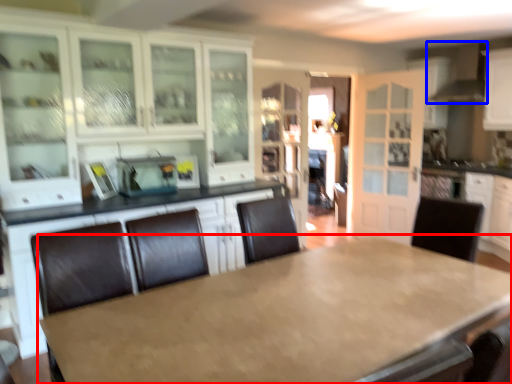
Question: Among these objects, which one is nearest to the camera, table (highlighted by a red box) or exhaust hood (highlighted by a blue box)?

Choices:
 (A) table
 (B) exhaust hood

Answer: (A)